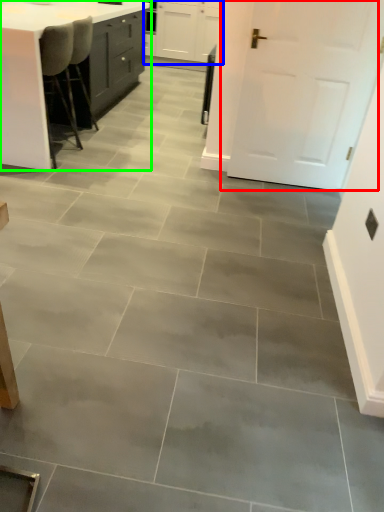
Question: Which is nearer to the door (highlighted by a red box)? cabinetry (highlighted by a blue box) or table (highlighted by a green box).

Choices:
 (A) cabinetry
 (B) table

Answer: (B)